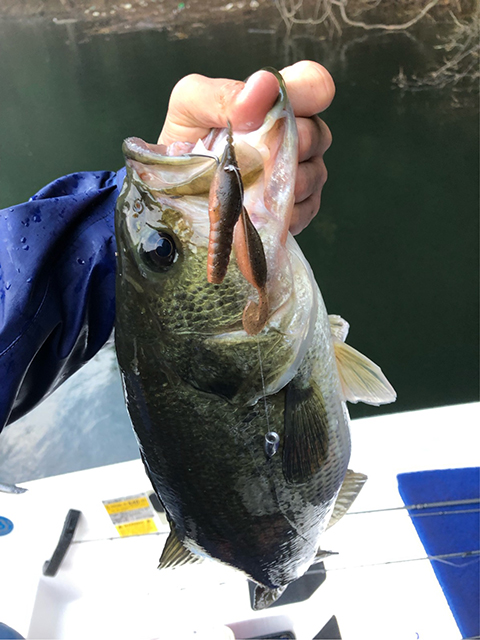
At what (x,y) coordinates should I click in order to perform the action: click on hook. Please return your answer as a coordinate pair (x, y). This screenshot has width=480, height=640. Looking at the image, I should click on (272, 447).